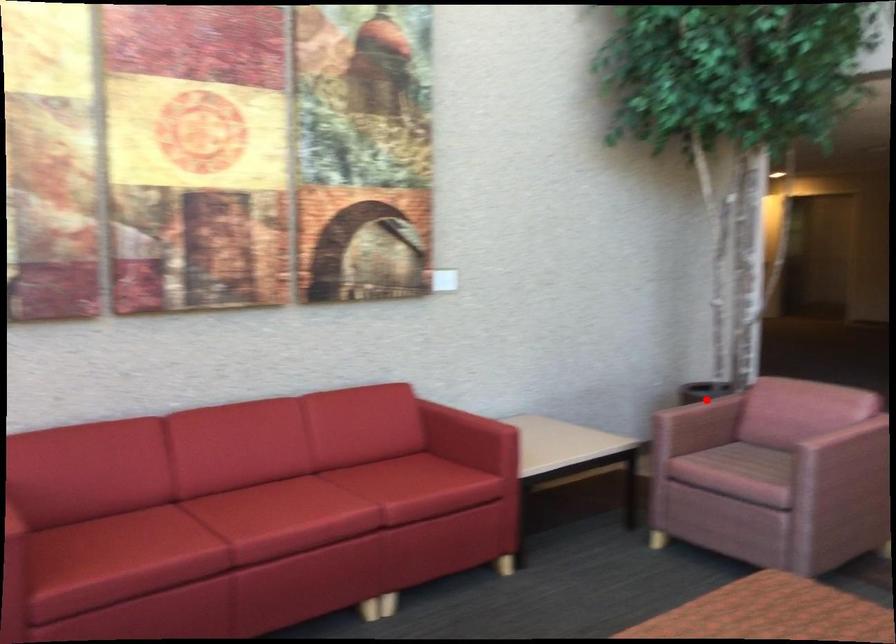
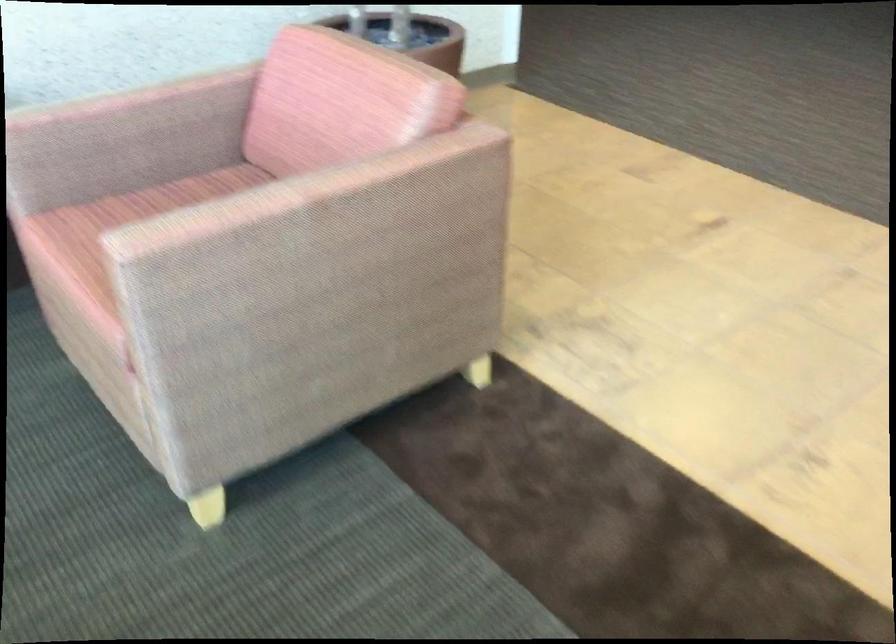
Question: I am providing you with two images of the same scene from different viewpoints. Given a red point in image1, look at the same physical point in image2. Is it:

Choices:
 (A) Closer to the viewpoint
 (B) Farther from the viewpoint

Answer: (A)